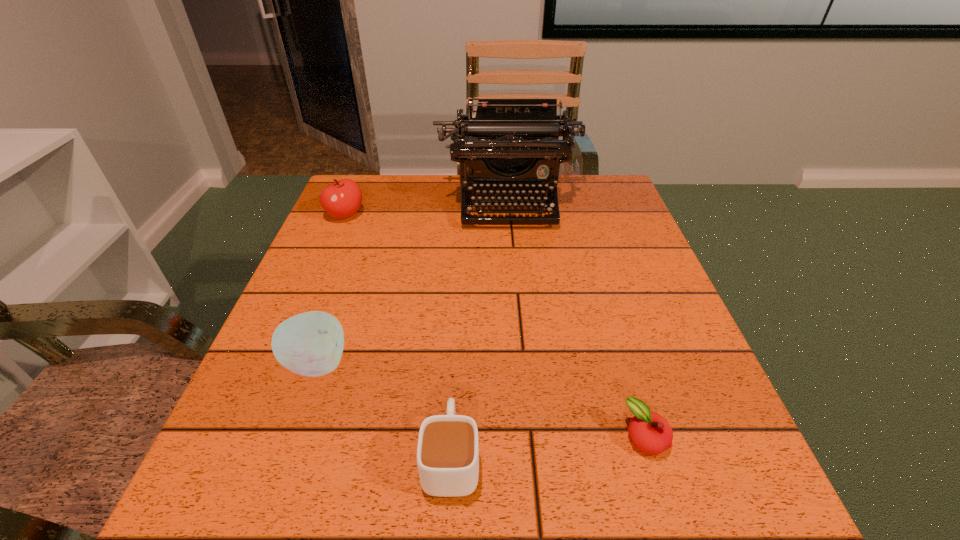
Find the location of a particular element. This screenshot has height=540, width=960. free space that satisfies the following two spatial constraints: 1. on the front side of the farthest apple; 2. on the right side of the shortest apple is located at coordinates (252, 437).

I want to click on vacant region that satisfies the following two spatial constraints: 1. on the keyboard of the typewriter; 2. on the right side of the shortest object, so click(528, 437).